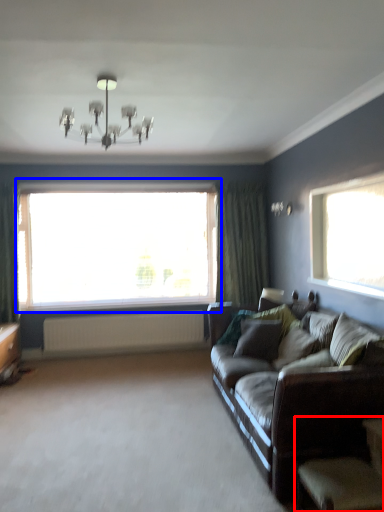
Question: Which point is further to the camera, armchair (highlighted by a red box) or window (highlighted by a blue box)?

Choices:
 (A) armchair
 (B) window

Answer: (B)